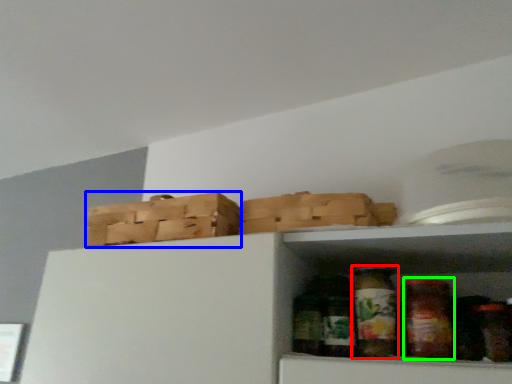
Question: Which object is positioned closest to glass jar (highlighted by a red box)? Select from basket (highlighted by a blue box) and glass jar (highlighted by a green box).

Choices:
 (A) basket
 (B) glass jar

Answer: (B)